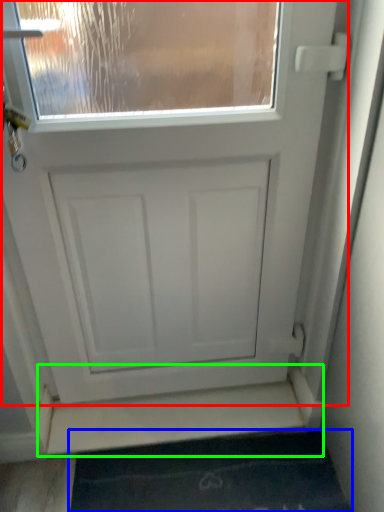
Question: Which object is the farthest from door (highlighted by a red box)? Choose among these: bath mat (highlighted by a blue box) or stairwell (highlighted by a green box).

Choices:
 (A) bath mat
 (B) stairwell

Answer: (A)